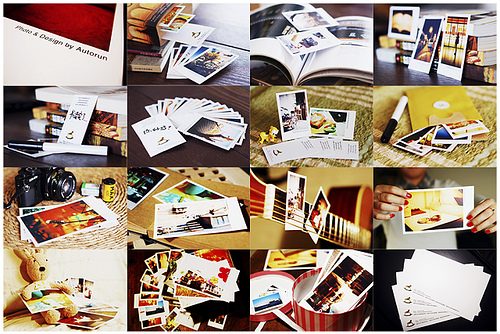
Identify the location of book. (331, 36).